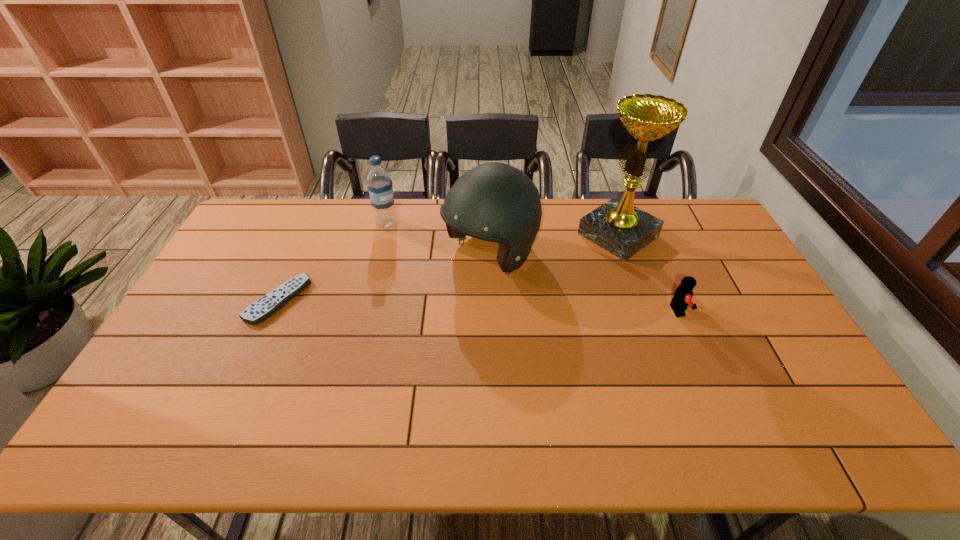
This screenshot has width=960, height=540. What are the coordinates of `vacant space situated on the front-facing side of the award` in the screenshot? It's located at (572, 267).

Identify the location of vacant space located 0.270m on the front-facing side of the award. (539, 290).

The image size is (960, 540). I want to click on free region located 0.240m on the front-facing side of the award, so point(545,286).

Where is `blank space located 0.400m at the face opening of the football helmet`? This screenshot has height=540, width=960. blank space located 0.400m at the face opening of the football helmet is located at coordinates (349, 350).

You are a GUI agent. You are given a task and a screenshot of the screen. Output one action in this format:
    pyautogui.click(x=<x>, y=<y>)
    Task: Click on the vacant space located 0.250m at the face opening of the football helmet
    
    Given the screenshot: What is the action you would take?
    pyautogui.click(x=394, y=320)

This screenshot has width=960, height=540. Find the location of `vacant space located at the face opening of the football helmet`. vacant space located at the face opening of the football helmet is located at coordinates 380,330.

At what (x,y) coordinates should I click in order to perform the action: click on vacant space positioned on the label of the second object from left to right. Please return your answer as a coordinate pair (x, y). The height and width of the screenshot is (540, 960). Looking at the image, I should click on (417, 272).

The height and width of the screenshot is (540, 960). What are the coordinates of `vacant space located 0.180m on the label of the second object from left to right` in the screenshot? It's located at (409, 260).

Locate an element on the screen. vacant point located on the label of the second object from left to right is located at coordinates point(402,249).

Identify the location of award at the far edge. This screenshot has width=960, height=540. (617, 226).